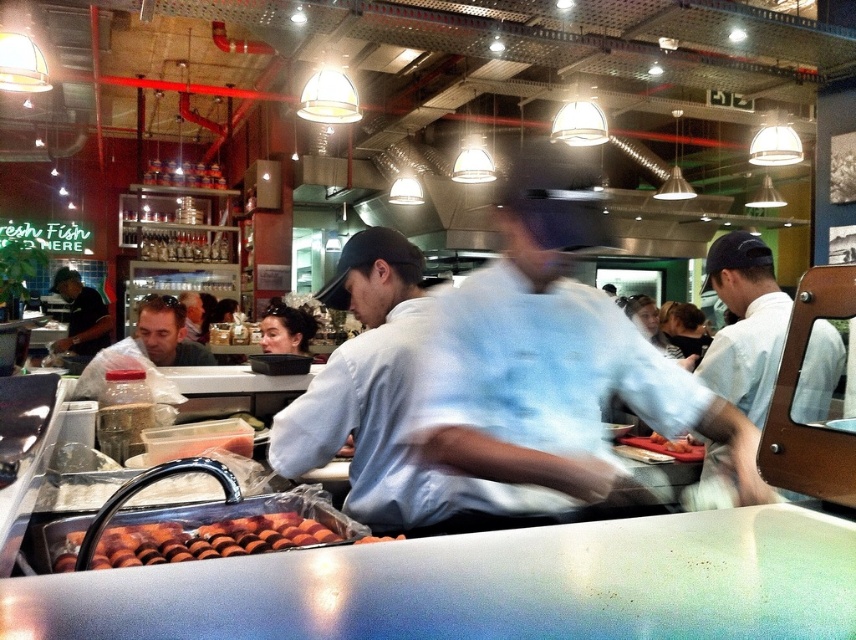
You are a customer observing the kitchen from the entrance. You notice two staff members wearing different colored shirts. Which staff member is standing closer to the entrance, the matte black shirt at center or the dark gray shirt at left?

The matte black shirt at center is closer to the viewer than the dark gray shirt at left, so the matte black shirt at center is standing closer to the entrance.

You are a new chef in the kitchen and need to reach both the point at coordinate (197, 356) and the point at coordinate (85, 332). Which coordinate will you reach first?

You will reach point (197, 356) first because it is closer to you than point (85, 332).

You are a chef in this kitchen and need to place both the white smooth shirt at center and the smooth orange slices at center on a small plate. Which object should you place first to ensure they both fit on the plate?

You should place the smooth orange slices at center first because they are smaller in size compared to the white smooth shirt at center, allowing more space for the larger item afterward.